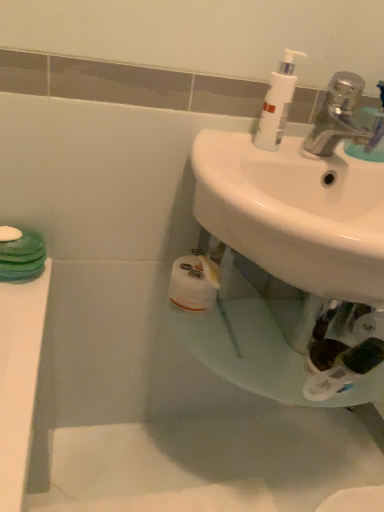
Question: From the image's perspective, is white glossy sink at center on white plastic pump bottle at upper right?

Choices:
 (A) no
 (B) yes

Answer: (A)

Question: Does white glossy sink at center lie in front of white plastic pump bottle at upper right?

Choices:
 (A) yes
 (B) no

Answer: (A)

Question: Is white glossy sink at center positioned far away from white plastic pump bottle at upper right?

Choices:
 (A) no
 (B) yes

Answer: (A)

Question: Is white plastic pump bottle at upper right surrounded by white glossy sink at center?

Choices:
 (A) yes
 (B) no

Answer: (B)

Question: Is white glossy sink at center thinner than white plastic pump bottle at upper right?

Choices:
 (A) yes
 (B) no

Answer: (B)

Question: Is white glossy sink at center shorter than white plastic pump bottle at upper right?

Choices:
 (A) yes
 (B) no

Answer: (B)

Question: Is silver metallic faucet at upper right wider than white plastic pump bottle at upper right?

Choices:
 (A) yes
 (B) no

Answer: (A)

Question: Is silver metallic faucet at upper right turned away from white plastic pump bottle at upper right?

Choices:
 (A) no
 (B) yes

Answer: (A)

Question: Can you confirm if silver metallic faucet at upper right is shorter than white plastic pump bottle at upper right?

Choices:
 (A) no
 (B) yes

Answer: (B)

Question: Is silver metallic faucet at upper right at the left side of white plastic pump bottle at upper right?

Choices:
 (A) no
 (B) yes

Answer: (A)

Question: Can you confirm if silver metallic faucet at upper right is taller than white plastic pump bottle at upper right?

Choices:
 (A) yes
 (B) no

Answer: (B)

Question: Does silver metallic faucet at upper right turn towards white plastic pump bottle at upper right?

Choices:
 (A) no
 (B) yes

Answer: (A)

Question: Is white glossy sink at center to the left of silver metallic faucet at upper right from the viewer's perspective?

Choices:
 (A) no
 (B) yes

Answer: (B)